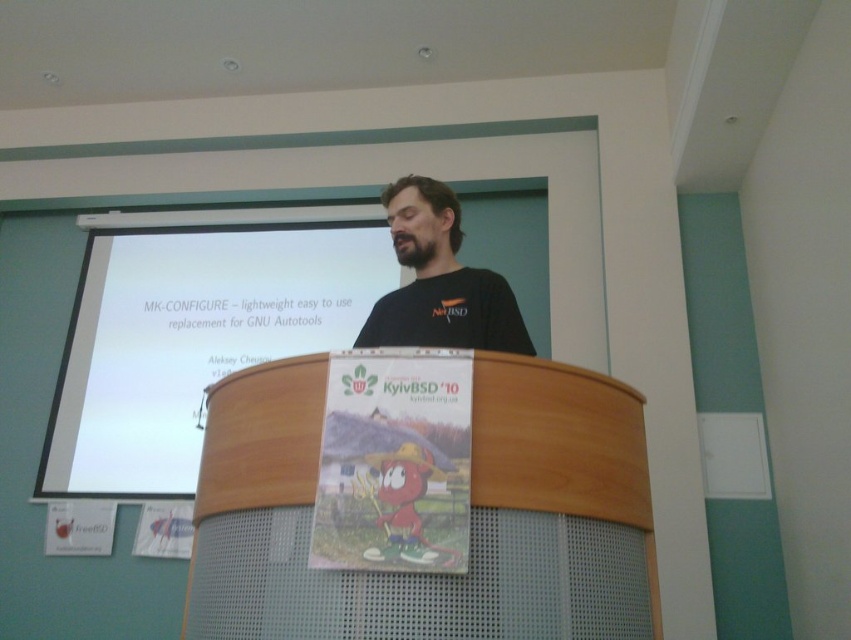
From the picture: Does wooden podium at center appear over white matte projection screen at upper center?

Actually, wooden podium at center is below white matte projection screen at upper center.

Between wooden podium at center and white matte projection screen at upper center, which one has less height?

wooden podium at center is shorter.

The height and width of the screenshot is (640, 851). I want to click on wooden podium at center, so click(470, 522).

The height and width of the screenshot is (640, 851). In order to click on wooden podium at center in this screenshot , I will do `click(470, 522)`.

Between point (604, 556) and point (391, 330), which one is positioned behind?

Point (391, 330)

The width and height of the screenshot is (851, 640). Describe the element at coordinates (470, 522) in the screenshot. I see `wooden podium at center` at that location.

The height and width of the screenshot is (640, 851). Describe the element at coordinates (470, 522) in the screenshot. I see `wooden podium at center` at that location.

Find the location of a particular element. The height and width of the screenshot is (640, 851). wooden podium at center is located at coordinates pos(470,522).

Is white matte projection screen at upper center further to camera compared to black matte shirt at center?

Yes, white matte projection screen at upper center is further from the viewer.

Does white matte projection screen at upper center appear under black matte shirt at center?

Yes, white matte projection screen at upper center is below black matte shirt at center.

This screenshot has height=640, width=851. Identify the location of white matte projection screen at upper center. (192, 337).